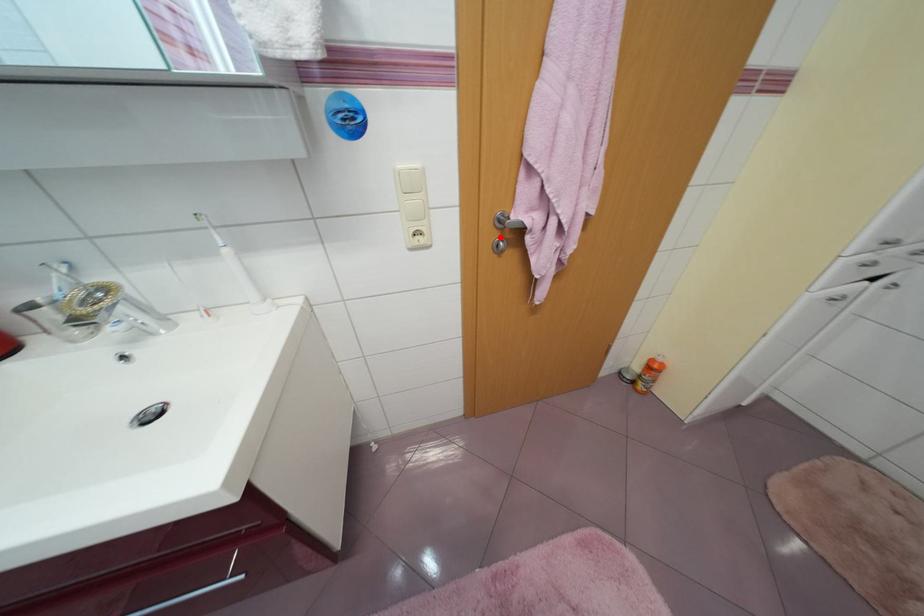
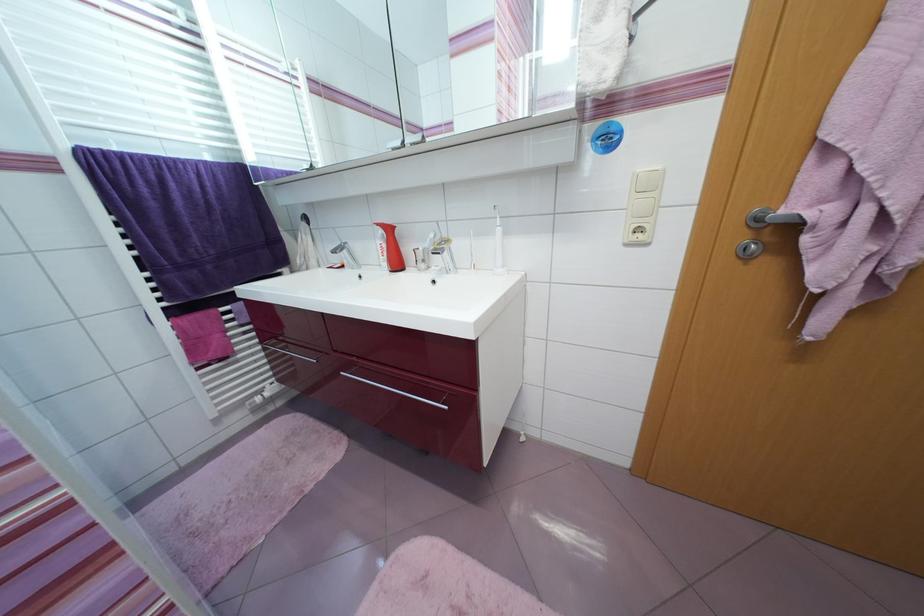
The point at the highlighted location is marked in the first image. Where is the corresponding point in the second image?

(748, 238)